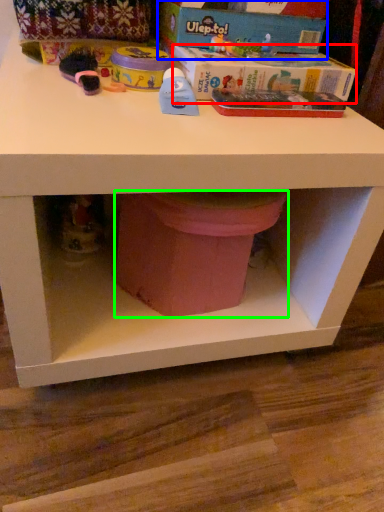
Question: Based on their relative distances, which object is nearer to box (highlighted by a red box)? Choose from box (highlighted by a blue box) and potty (highlighted by a green box).

Choices:
 (A) box
 (B) potty

Answer: (A)